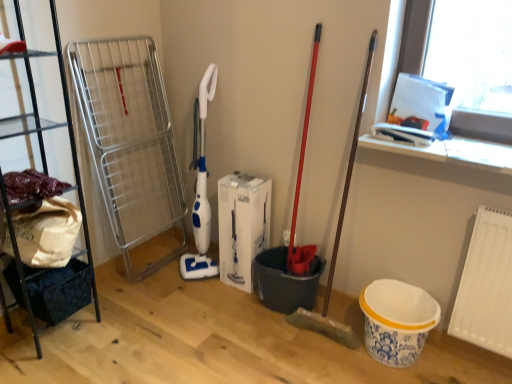
What do you see at coordinates (486, 285) in the screenshot? I see `white matte radiator at lower right` at bounding box center [486, 285].

Where is `dark blue fabric basket at lower left`? This screenshot has height=384, width=512. dark blue fabric basket at lower left is located at coordinates (61, 292).

This screenshot has height=384, width=512. Find the location of `white matte radiator at lower right`. white matte radiator at lower right is located at coordinates (486, 285).

In the scene shown: Based on their positions, is white matte radiator at lower right located to the left or right of black metal shelf at left?

Based on their positions, white matte radiator at lower right is located to the right of black metal shelf at left.

Can you confirm if white matte radiator at lower right is thinner than black metal shelf at left?

Yes.

At what (x,y) coordinates should I click in order to perform the action: click on shelf that is above the white matte radiator at lower right (from the image's perspective). Please return your answer as a coordinate pair (x, y). The image size is (512, 384). Looking at the image, I should click on (39, 203).

Consider the image. From their relative heights in the image, would you say white matte radiator at lower right is taller or shorter than black metal shelf at left?

Considering their sizes, white matte radiator at lower right has less height than black metal shelf at left.

Is dark blue fabric basket at lower left positioned far away from black metal shelf at left?

No, there isn't a large distance between dark blue fabric basket at lower left and black metal shelf at left.

Considering the sizes of dark blue fabric basket at lower left and black metal shelf at left in the image, is dark blue fabric basket at lower left bigger or smaller than black metal shelf at left?

In the image, dark blue fabric basket at lower left appears to be smaller than black metal shelf at left.

In the scene shown: Is dark blue fabric basket at lower left aimed at black metal shelf at left?

Yes.

Where is `basket that appears behind the white matte radiator at lower right`? basket that appears behind the white matte radiator at lower right is located at coordinates (61, 292).

Which is more to the right, dark blue fabric basket at lower left or white matte radiator at lower right?

From the viewer's perspective, white matte radiator at lower right appears more on the right side.

Would you say dark blue fabric basket at lower left is a long distance from white matte radiator at lower right?

dark blue fabric basket at lower left is far away from white matte radiator at lower right.

Is dark blue fabric basket at lower left oriented away from white matte radiator at lower right?

No, white matte radiator at lower right is not at the back of dark blue fabric basket at lower left.

Which object is thinner, black metal shelf at left or white matte radiator at lower right?

white matte radiator at lower right is thinner.

Considering the positions of points (49, 211) and (469, 256), is point (49, 211) farther from camera compared to point (469, 256)?

Yes, it is.

Consider the image. Can white matte radiator at lower right be found inside black metal shelf at left?

That's incorrect, white matte radiator at lower right is not inside black metal shelf at left.

How many degrees apart are the facing directions of black metal shelf at left and white matte radiator at lower right?

They differ by 88.8 degrees in their facing directions.

Find the location of a particular element. The width and height of the screenshot is (512, 384). shelf above the dark blue fabric basket at lower left (from a real-world perspective) is located at coordinates (39, 203).

Looking at this image, in terms of width, does black metal shelf at left look wider or thinner when compared to dark blue fabric basket at lower left?

Considering their sizes, black metal shelf at left looks broader than dark blue fabric basket at lower left.

Can you tell me how much black metal shelf at left and dark blue fabric basket at lower left differ in facing direction?

black metal shelf at left and dark blue fabric basket at lower left are facing 1.54 degrees away from each other.

Between black metal shelf at left and dark blue fabric basket at lower left, which one has smaller size?

Smaller between the two is dark blue fabric basket at lower left.

Considering the positions of objects white matte radiator at lower right and dark blue fabric basket at lower left in the image provided, who is more to the left, white matte radiator at lower right or dark blue fabric basket at lower left?

dark blue fabric basket at lower left.

Can you tell me how much white matte radiator at lower right and dark blue fabric basket at lower left differ in facing direction?

The angle between the facing direction of white matte radiator at lower right and the facing direction of dark blue fabric basket at lower left is 87.3 degrees.

Are white matte radiator at lower right and dark blue fabric basket at lower left beside each other?

white matte radiator at lower right and dark blue fabric basket at lower left are not in contact.

Would you say white matte radiator at lower right is inside or outside dark blue fabric basket at lower left?

A: white matte radiator at lower right is not enclosed by dark blue fabric basket at lower left.

Where is `radiator below the black metal shelf at left (from the image's perspective)`? radiator below the black metal shelf at left (from the image's perspective) is located at coordinates (486, 285).

There is a dark blue fabric basket at lower left. At what (x,y) coordinates should I click in order to perform the action: click on shelf above it (from a real-world perspective). Please return your answer as a coordinate pair (x, y). Looking at the image, I should click on (39, 203).

Looking at the image, which one is located closer to dark blue fabric basket at lower left, white matte radiator at lower right or black metal shelf at left?

black metal shelf at left is positioned closer to the anchor dark blue fabric basket at lower left.

In the scene shown: Which object lies nearer to the anchor point dark blue fabric basket at lower left, black metal shelf at left or white matte radiator at lower right?

black metal shelf at left.

Estimate the real-world distances between objects in this image. Which object is further from white matte radiator at lower right, black metal shelf at left or dark blue fabric basket at lower left?

The object further to white matte radiator at lower right is black metal shelf at left.

Looking at the image, which one is located further to black metal shelf at left, dark blue fabric basket at lower left or white matte radiator at lower right?

white matte radiator at lower right lies further to black metal shelf at left than the other object.

From the image, which object appears to be nearer to black metal shelf at left, white matte radiator at lower right or dark blue fabric basket at lower left?

dark blue fabric basket at lower left lies closer to black metal shelf at left than the other object.

Based on their spatial positions, is dark blue fabric basket at lower left or black metal shelf at left closer to white matte radiator at lower right?

dark blue fabric basket at lower left lies closer to white matte radiator at lower right than the other object.

The width and height of the screenshot is (512, 384). I want to click on basket between black metal shelf at left and white matte radiator at lower right, so click(x=61, y=292).